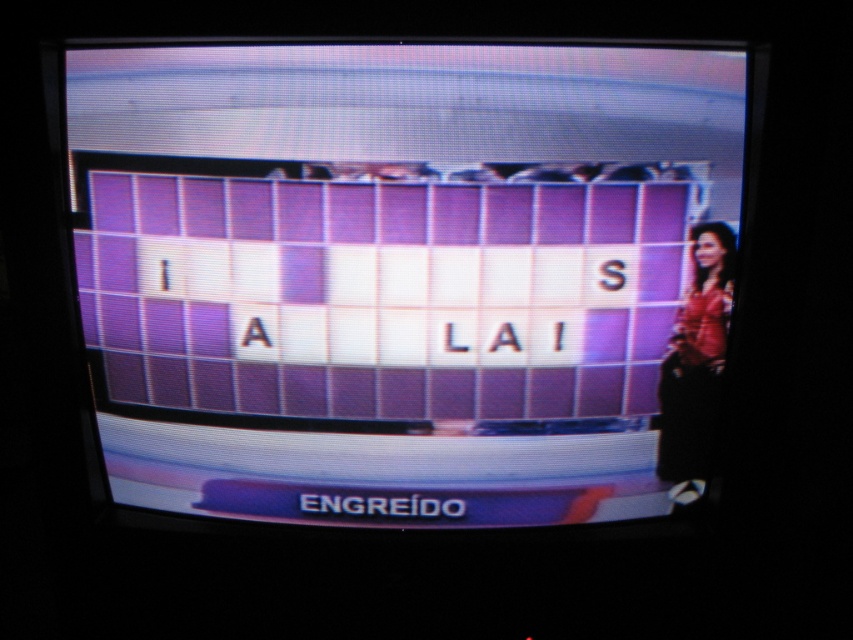
You are a contestant on a game show and you see the purple glossy tiles at center and the matte pink dress at right on the TV screen. Which object is taller?

The purple glossy tiles at center is much taller than the matte pink dress at right.

In the scene shown: You are a contestant on a game show and you see the purple glossy tiles at center and the matte pink dress at right on the screen. Which object is positioned higher up on the screen?

The purple glossy tiles at center is positioned higher up on the screen than the matte pink dress at right.